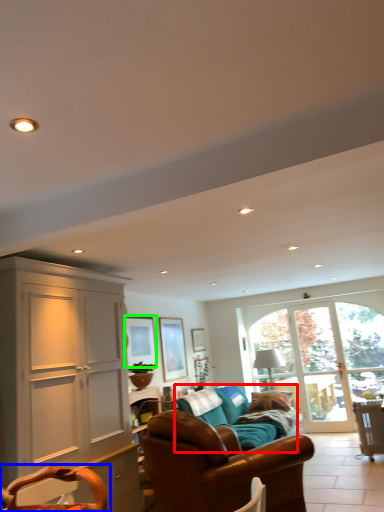
Question: Estimate the real-world distances between objects in this image. Which object is closer to studio couch (highlighted by a red box), swivel chair (highlighted by a blue box) or picture frame (highlighted by a green box)?

Choices:
 (A) swivel chair
 (B) picture frame

Answer: (B)